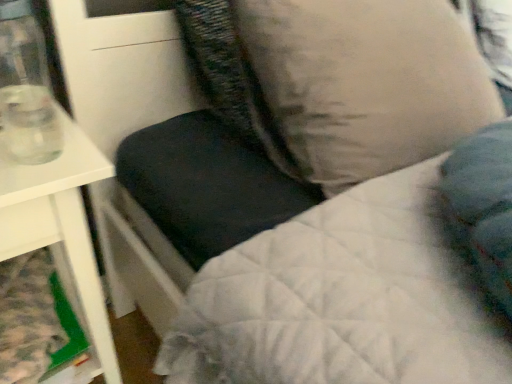
Question: Is white glossy table at left at the back of transparent glass at left?

Choices:
 (A) no
 (B) yes

Answer: (A)

Question: Considering the relative sizes of transparent glass at left and white glossy table at left in the image provided, is transparent glass at left shorter than white glossy table at left?

Choices:
 (A) no
 (B) yes

Answer: (B)

Question: Is transparent glass at left beside white glossy table at left?

Choices:
 (A) yes
 (B) no

Answer: (B)

Question: Does transparent glass at left have a greater height compared to white glossy table at left?

Choices:
 (A) yes
 (B) no

Answer: (B)

Question: Is transparent glass at left to the right of white glossy table at left from the viewer's perspective?

Choices:
 (A) no
 (B) yes

Answer: (B)

Question: Is transparent glass at left outside white glossy table at left?

Choices:
 (A) no
 (B) yes

Answer: (B)

Question: From the image's perspective, is beige fabric pillow at upper right over transparent glass at left?

Choices:
 (A) yes
 (B) no

Answer: (A)

Question: Can you confirm if beige fabric pillow at upper right is positioned to the right of transparent glass at left?

Choices:
 (A) no
 (B) yes

Answer: (B)

Question: Are beige fabric pillow at upper right and transparent glass at left far apart?

Choices:
 (A) no
 (B) yes

Answer: (A)

Question: From a real-world perspective, does beige fabric pillow at upper right stand above transparent glass at left?

Choices:
 (A) yes
 (B) no

Answer: (B)

Question: Does beige fabric pillow at upper right have a greater height compared to transparent glass at left?

Choices:
 (A) no
 (B) yes

Answer: (B)

Question: Is beige fabric pillow at upper right looking in the opposite direction of transparent glass at left?

Choices:
 (A) yes
 (B) no

Answer: (B)

Question: From the image's perspective, is beige fabric pillow at upper right below white glossy table at left?

Choices:
 (A) no
 (B) yes

Answer: (A)